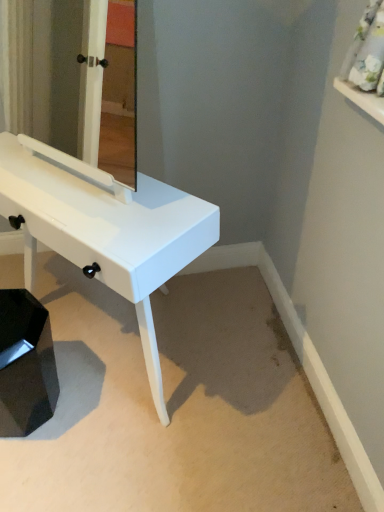
You are a GUI agent. You are given a task and a screenshot of the screen. Output one action in this format:
    pyautogui.click(x=<x>, y=<y>)
    Task: Click on the free space in front of black glossy step stool at lower left
    This screenshot has width=384, height=512.
    Given the screenshot: What is the action you would take?
    pyautogui.click(x=35, y=471)